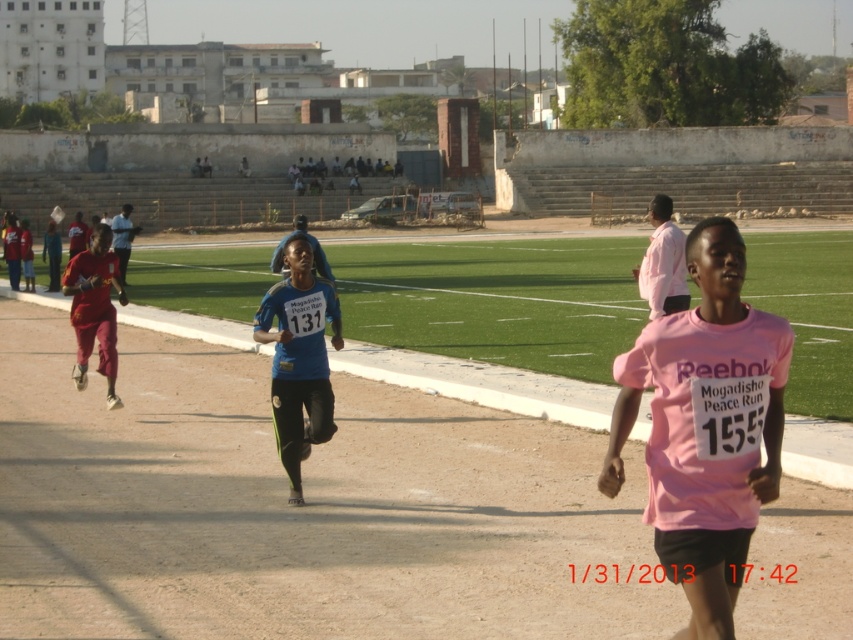
You are a race official observing the runners on the track. You need to determine the current position of the pink matte shirt at center and the matte red shorts at left. Which runner is leading between these two?

The pink matte shirt at center is in front of the matte red shorts at left, so the pink matte shirt at center is leading in the race between these two runners.

You are a race official trying to locate the runner wearing the pink matte shirt at center for a disqualification notice. According to the track coordinates, where exactly should you look to find this runner?

The pink matte shirt at center is located at coordinates point (705, 426), so you should look there to find the runner.

You are a photographer positioned at the starting line of the track. You want to take a photo that includes both the point at coordinates point(663,380) and point(274,374). Which point will appear larger in the photo?

Point(663,380) is closer to the viewer than point(274,374), so it will appear larger in the photo.